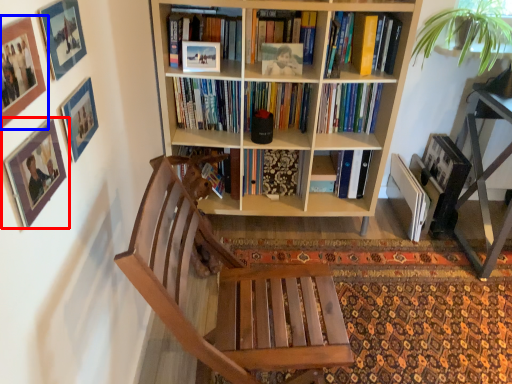
Question: Which object appears farthest to the camera in this image, picture frame (highlighted by a red box) or picture frame (highlighted by a blue box)?

Choices:
 (A) picture frame
 (B) picture frame

Answer: (A)